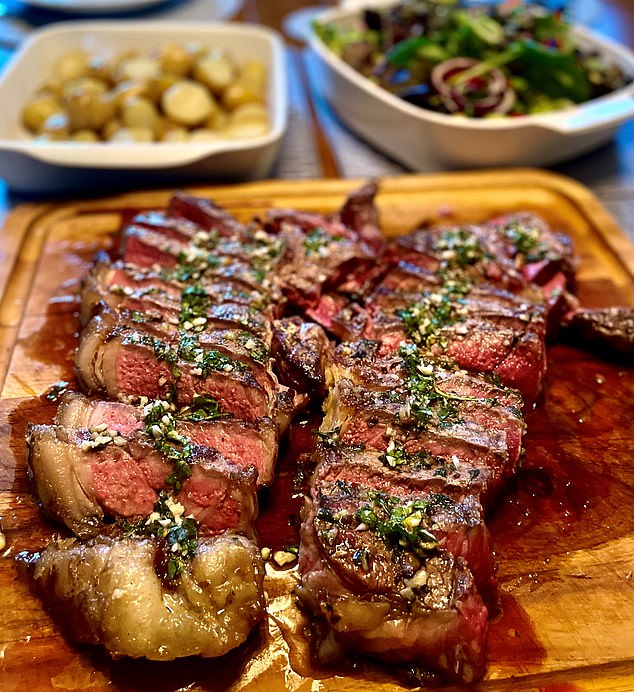
Identify the location of wooden cutting board. This screenshot has width=634, height=692. (467, 192).